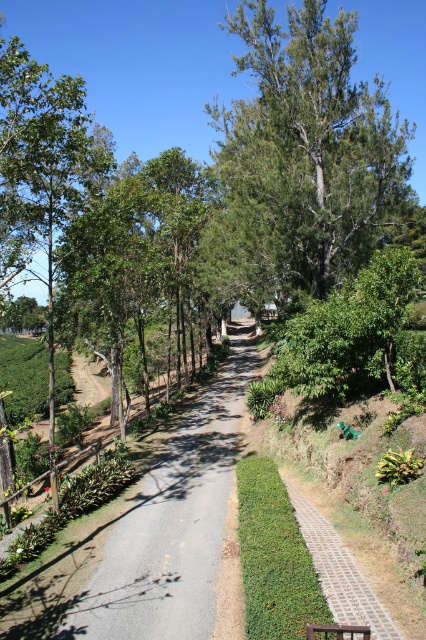
Question: Which of the following is the farthest from the observer?

Choices:
 (A) (340, 561)
 (B) (308, 625)

Answer: (A)

Question: Which point is farther to the camera?

Choices:
 (A) (322, 625)
 (B) (144, 499)
 (C) (301, 138)
 (D) (385, 634)

Answer: (C)

Question: Is gray gravel trail at center above brown wooden bench at center?

Choices:
 (A) no
 (B) yes

Answer: (A)

Question: Which object is closer to the camera taking this photo?

Choices:
 (A) green leafy tree at center
 (B) brown wooden bench at center

Answer: (B)

Question: Is green leafy tree at center bigger than gray gravel trail at center?

Choices:
 (A) yes
 (B) no

Answer: (A)

Question: Observing the image, what is the correct spatial positioning of green leafy tree at center in reference to brown wooden bench at center?

Choices:
 (A) right
 (B) left

Answer: (A)